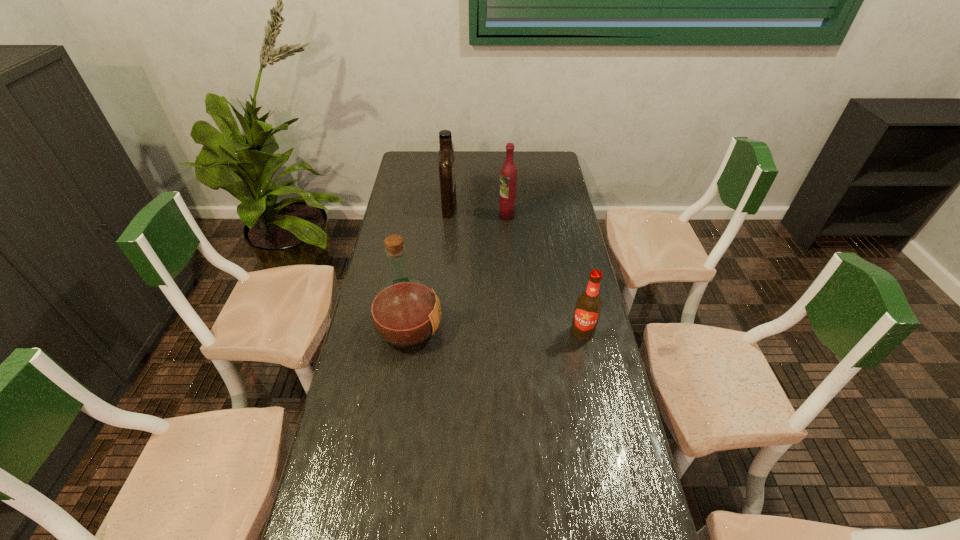
At what (x,y) coordinates should I click in order to perform the action: click on the nearest liquor. Please return your answer as a coordinate pair (x, y). Looking at the image, I should click on (405, 312).

Identify the location of the third object from left to right. (508, 176).

Image resolution: width=960 pixels, height=540 pixels. I want to click on beer bottle, so click(x=588, y=306).

Where is `the shortest object`? the shortest object is located at coordinates [x=588, y=306].

What are the coordinates of `free spot located on the front label of the nearest liquor` in the screenshot? It's located at (476, 329).

Identify the location of vacant position located 0.070m on the label of the rightmost liquor. Image resolution: width=960 pixels, height=540 pixels. (483, 215).

Locate an element on the screen. The width and height of the screenshot is (960, 540). vacant space located on the label of the rightmost liquor is located at coordinates (422, 215).

This screenshot has width=960, height=540. I want to click on vacant space located 0.230m on the label of the rightmost liquor, so click(445, 215).

Where is `vacant space located on the left of the beer bottle`? This screenshot has width=960, height=540. vacant space located on the left of the beer bottle is located at coordinates (494, 333).

What are the coordinates of `object that is at the left edge` in the screenshot? It's located at (405, 312).